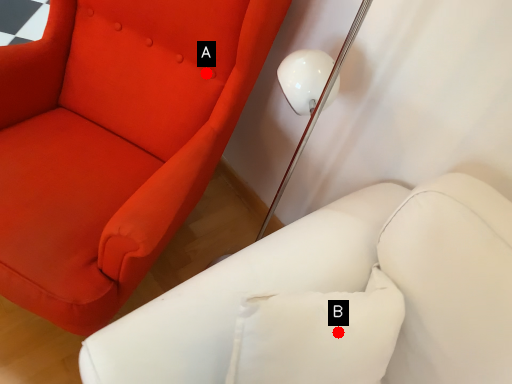
Question: Two points are circled on the image, labeled by A and B beside each circle. Among these points, which one is farthest from the camera?

Choices:
 (A) A is further
 (B) B is further

Answer: (A)